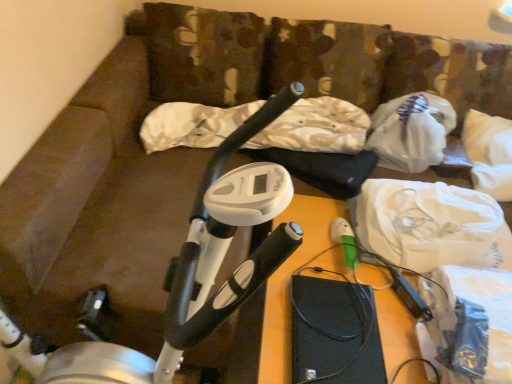
Question: In terms of width, does white fabric at upper right look wider or thinner when compared to white plastic bag at upper right?

Choices:
 (A) thin
 (B) wide

Answer: (B)

Question: Is white fabric at upper right to the left or to the right of white plastic bag at upper right in the image?

Choices:
 (A) right
 (B) left

Answer: (B)

Question: Which object is positioned farthest from the white fabric at upper right?

Choices:
 (A) white plastic bag at upper right
 (B) white plastic stationary bicycle at left

Answer: (B)

Question: Which is farther from the white plastic stationary bicycle at left?

Choices:
 (A) white plastic bag at upper right
 (B) white fabric at upper right

Answer: (A)